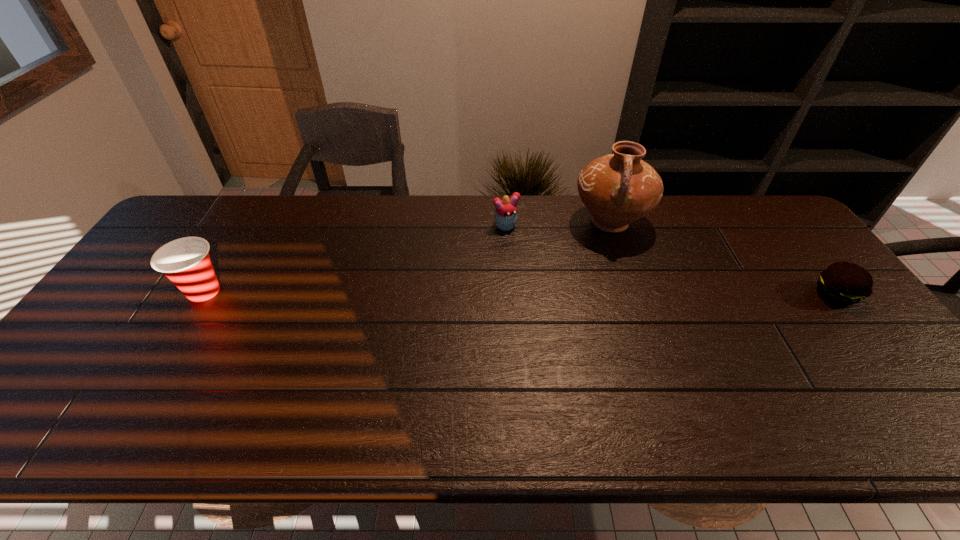
The width and height of the screenshot is (960, 540). I want to click on vacant space on the desktop that is between the leftmost object and the rightmost object and is positioned on the face of the cupcake, so click(x=554, y=293).

Image resolution: width=960 pixels, height=540 pixels. Find the location of `free spot on the desktop that is between the leftmost object and the shortest object and is positioned on the side of the third object from left to right with the handle`. free spot on the desktop that is between the leftmost object and the shortest object and is positioned on the side of the third object from left to right with the handle is located at coordinates (595, 294).